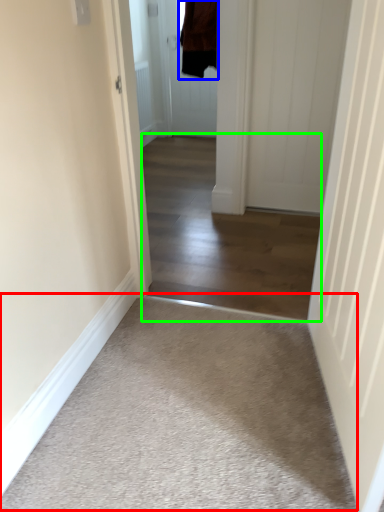
Question: Which object is positioned farthest from plain (highlighted by a red box)? Select from jacket (highlighted by a blue box) and corridor (highlighted by a green box).

Choices:
 (A) jacket
 (B) corridor

Answer: (A)